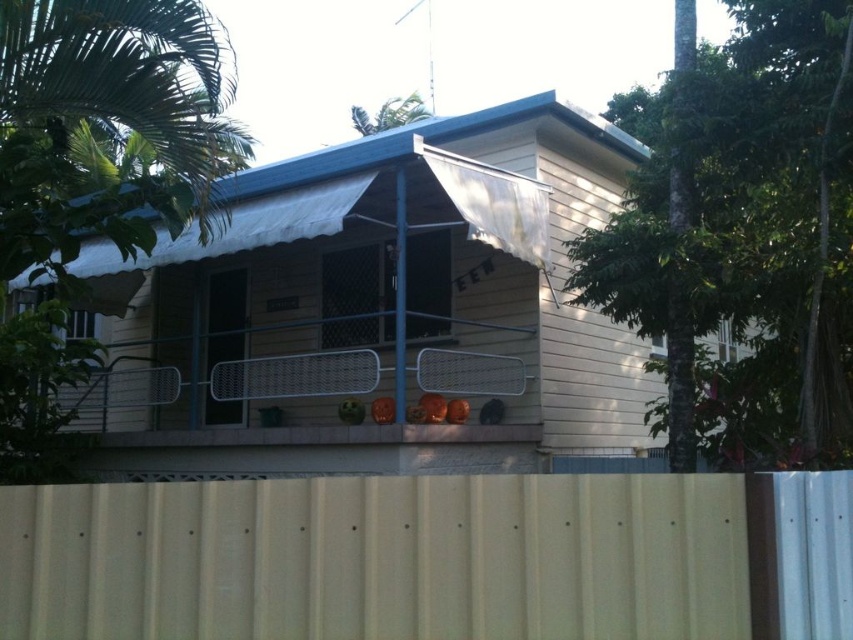
Between point (187, 576) and point (291, 394), which one is positioned in front?

Positioned in front is point (187, 576).

Is point (276, 548) less distant than point (338, 353)?

Yes, it is.

The height and width of the screenshot is (640, 853). In order to click on tan corrugated metal at lower center in this screenshot , I will do `click(378, 557)`.